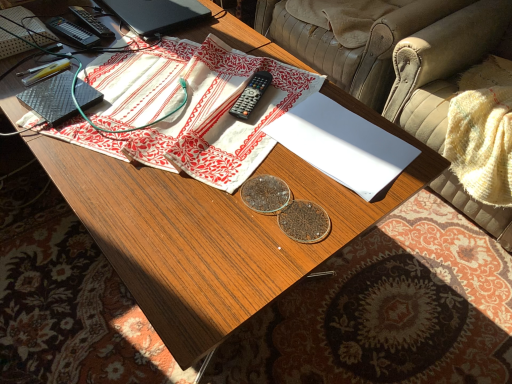
Identify the location of vacant space underneath white paper at center (from a real-world perspective). (343, 142).